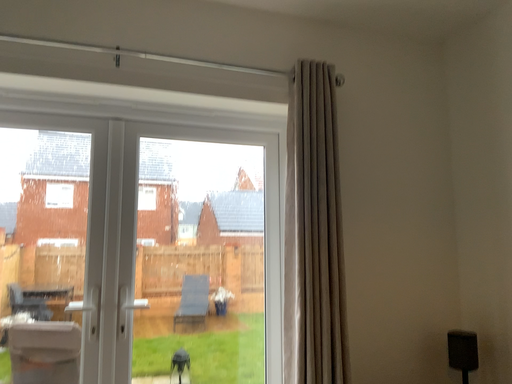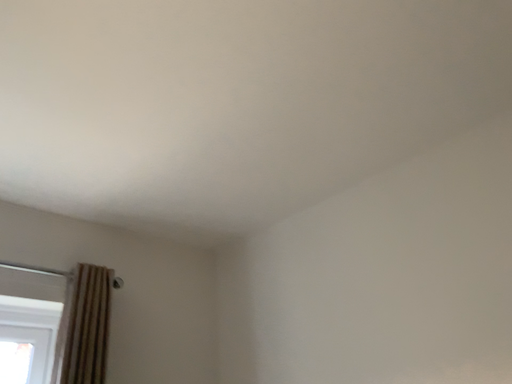
Question: Which way did the camera rotate in the video?

Choices:
 (A) rotated right
 (B) rotated left

Answer: (A)